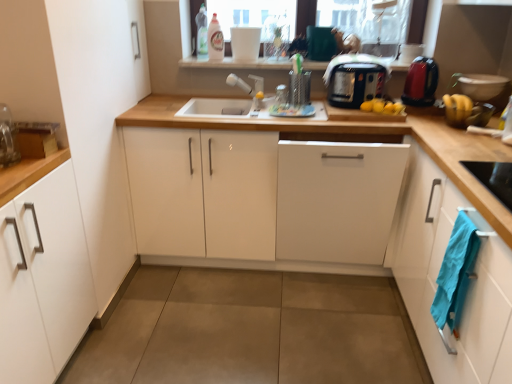
Image resolution: width=512 pixels, height=384 pixels. What do you see at coordinates (355, 84) in the screenshot?
I see `black plastic toaster at upper center, the first appliance in the left-to-right sequence` at bounding box center [355, 84].

This screenshot has width=512, height=384. I want to click on black plastic toaster at upper center, the first appliance in the left-to-right sequence, so click(x=355, y=84).

In order to face white glossy cabinet at center, the third cabinetry when ordered from right to left, should I rotate leftwards or rightwards?

A 0.737 degree turn to the right will do.

Where is `white glossy cabinet at center, arranged as the second cabinetry when viewed from the left`? The height and width of the screenshot is (384, 512). white glossy cabinet at center, arranged as the second cabinetry when viewed from the left is located at coordinates (262, 200).

What do you see at coordinates (337, 200) in the screenshot?
I see `white matte cabinet at center, the 3th cabinetry positioned from the left` at bounding box center [337, 200].

The image size is (512, 384). I want to click on white matte cabinet at right, acting as the 1th cabinetry starting from the right, so click(x=438, y=273).

Measure the distance between point (x=223, y=50) and camera.

They are 2.54 meters apart.

Locate an element on the screen. Image resolution: width=512 pixels, height=384 pixels. black plastic toaster at upper center, the first appliance in the left-to-right sequence is located at coordinates (355, 84).

In the scene shown: Does transparent plastic bottle at upper center, which is the first bottle in left-to-right order, have a greater width compared to white matte cabinet at center, the 3th cabinetry positioned from the left?

No, transparent plastic bottle at upper center, which is the first bottle in left-to-right order, is not wider than white matte cabinet at center, the 3th cabinetry positioned from the left.

From the image's perspective, which cabinetry is the 2nd one below the transparent plastic bottle at upper center, placed as the second bottle when sorted from right to left? Please provide its 2D coordinates.

[(337, 200)]

From a real-world perspective, is transparent plastic bottle at upper center, placed as the second bottle when sorted from right to left, located higher than white matte cabinet at center, the 3th cabinetry positioned from the left?

Yes.

Is point (23, 204) closer or farther from the camera than point (223, 52)?

Point (23, 204) is closer to the camera than point (223, 52).

Which object is positioned more to the left, white matte cabinet at left, marked as the 1th cabinetry in a left-to-right arrangement, or translucent plastic bottle at upper center, placed as the first bottle when sorted from right to left?

Positioned to the left is white matte cabinet at left, marked as the 1th cabinetry in a left-to-right arrangement.

Based on their sizes in the image, would you say white matte cabinet at left, the fourth cabinetry in the right-to-left sequence, is bigger or smaller than translucent plastic bottle at upper center, the 2th bottle from the left?

white matte cabinet at left, the fourth cabinetry in the right-to-left sequence, is bigger than translucent plastic bottle at upper center, the 2th bottle from the left.

Is white matte cabinet at left, the fourth cabinetry in the right-to-left sequence, further to camera compared to translucent plastic bottle at upper center, placed as the first bottle when sorted from right to left?

That is False.

From a real-world perspective, is blue cotton towel at lower right positioned under transparent plastic bottle at upper center, which is the first bottle in left-to-right order, based on gravity?

Yes, from a real-world perspective, blue cotton towel at lower right is beneath transparent plastic bottle at upper center, which is the first bottle in left-to-right order.

Considering the positions of points (435, 316) and (204, 55), is point (435, 316) farther from camera compared to point (204, 55)?

No, it is not.

Looking at this image, which of these two, blue cotton towel at lower right or transparent plastic bottle at upper center, placed as the second bottle when sorted from right to left, is bigger?

With larger size is blue cotton towel at lower right.

What's the angular difference between blue cotton towel at lower right and transparent plastic bottle at upper center, placed as the second bottle when sorted from right to left,'s facing directions?

They differ by 93.2 degrees in their facing directions.

Considering the positions of objects blue cotton towel at lower right and white matte faucet at center in the image provided, who is more to the left, blue cotton towel at lower right or white matte faucet at center?

Positioned to the left is white matte faucet at center.

Does blue cotton towel at lower right have a greater width compared to white matte faucet at center?

Incorrect, the width of blue cotton towel at lower right does not surpass that of white matte faucet at center.

Does blue cotton towel at lower right have a greater height compared to white matte faucet at center?

Yes.

Is blue cotton towel at lower right facing away from white matte faucet at center?

blue cotton towel at lower right does not have its back to white matte faucet at center.

Based on the photo, looking at the image, does blue cotton towel at lower right seem bigger or smaller compared to wooden at center?

In the image, blue cotton towel at lower right appears to be smaller than wooden at center.

Does point (444, 265) come in front of point (425, 116)?

Yes, it is in front of point (425, 116).

Is blue cotton towel at lower right not within wooden at center?

No.

This screenshot has height=384, width=512. Find the location of `laundry behind the wooden at center`. laundry behind the wooden at center is located at coordinates (455, 272).

From the picture: What's the angular difference between white matte cabinet at center, placed as the second cabinetry when sorted from right to left, and translucent plastic bottle at upper center, placed as the first bottle when sorted from right to left,'s facing directions?

The angular difference between white matte cabinet at center, placed as the second cabinetry when sorted from right to left, and translucent plastic bottle at upper center, placed as the first bottle when sorted from right to left, is 0.214 degrees.

How much distance is there between white matte cabinet at center, placed as the second cabinetry when sorted from right to left, and translucent plastic bottle at upper center, the 2th bottle from the left?

3.67 feet.

Does point (381, 176) come farther from viewer compared to point (215, 13)?

No, it is in front of (215, 13).

Which of these two, white matte cabinet at center, the 3th cabinetry positioned from the left, or translucent plastic bottle at upper center, placed as the first bottle when sorted from right to left, is wider?

With larger width is white matte cabinet at center, the 3th cabinetry positioned from the left.

Considering the positions of objects wooden at center and white matte cabinet at center, placed as the second cabinetry when sorted from right to left, in the image provided, who is in front, wooden at center or white matte cabinet at center, placed as the second cabinetry when sorted from right to left,?

Positioned in front is wooden at center.

From the image's perspective, who appears lower, wooden at center or white matte cabinet at center, the 3th cabinetry positioned from the left?

wooden at center is shown below in the image.

From a real-world perspective, is wooden at center on top of white matte cabinet at center, the 3th cabinetry positioned from the left?

Yes, from a real-world perspective, wooden at center is on top of white matte cabinet at center, the 3th cabinetry positioned from the left.

Does wooden at center have a greater height compared to white matte cabinet at center, placed as the second cabinetry when sorted from right to left?

Yes.

Where is `the 2nd bottle above when counting from the white matte cabinet at center, the 3th cabinetry positioned from the left (from the image's perspective)`? the 2nd bottle above when counting from the white matte cabinet at center, the 3th cabinetry positioned from the left (from the image's perspective) is located at coordinates (201, 32).

Locate an element on the screen. Image resolution: width=512 pixels, height=384 pixels. bottle that is the 1st one when counting backward from the white matte cabinet at left, the fourth cabinetry in the right-to-left sequence is located at coordinates (215, 40).

When comparing their distances from black plastic toaster at upper center, the first appliance in the left-to-right sequence, does white matte cabinet at right, acting as the 1th cabinetry starting from the right, or white matte faucet at center seem closer?

white matte faucet at center is closer to black plastic toaster at upper center, the first appliance in the left-to-right sequence.

Considering their positions, is white matte cabinet at right, marked as the 4th cabinetry in a left-to-right arrangement, positioned closer to black plastic toaster at upper center, the first appliance in the left-to-right sequence, than white matte cabinet at center, placed as the second cabinetry when sorted from right to left?

The object closer to black plastic toaster at upper center, the first appliance in the left-to-right sequence, is white matte cabinet at center, placed as the second cabinetry when sorted from right to left.

Based on their spatial positions, is white glossy cabinet at center, arranged as the second cabinetry when viewed from the left, or white matte cabinet at right, marked as the 4th cabinetry in a left-to-right arrangement, closer to white matte faucet at center?

Among the two, white glossy cabinet at center, arranged as the second cabinetry when viewed from the left, is located nearer to white matte faucet at center.

Estimate the real-world distances between objects in this image. Which object is closer to blue cotton towel at lower right, shiny red kettle at right, arranged as the second appliance when viewed from the left, or translucent plastic bottle at upper center, placed as the first bottle when sorted from right to left?

shiny red kettle at right, arranged as the second appliance when viewed from the left, is positioned closer to the anchor blue cotton towel at lower right.

When comparing their distances from white matte cabinet at right, acting as the 1th cabinetry starting from the right, does black plastic toaster at upper center, which is the second appliance from right to left, or white matte faucet at center seem further?

white matte faucet at center is further to white matte cabinet at right, acting as the 1th cabinetry starting from the right.

Based on their spatial positions, is translucent plastic bottle at upper center, the 2th bottle from the left, or black plastic toaster at upper center, which is the second appliance from right to left, further from white matte cabinet at right, marked as the 4th cabinetry in a left-to-right arrangement?

translucent plastic bottle at upper center, the 2th bottle from the left.

Estimate the real-world distances between objects in this image. Which object is closer to white matte cabinet at left, marked as the 1th cabinetry in a left-to-right arrangement, shiny red kettle at right, the 1th appliance when ordered from right to left, or black plastic toaster at upper center, which is the second appliance from right to left?

Among the two, black plastic toaster at upper center, which is the second appliance from right to left, is located nearer to white matte cabinet at left, marked as the 1th cabinetry in a left-to-right arrangement.

Considering their positions, is white matte cabinet at left, marked as the 1th cabinetry in a left-to-right arrangement, positioned further to transparent plastic bottle at upper center, which is the first bottle in left-to-right order, than white matte cabinet at center, the 3th cabinetry positioned from the left?

Based on the image, white matte cabinet at left, marked as the 1th cabinetry in a left-to-right arrangement, appears to be further to transparent plastic bottle at upper center, which is the first bottle in left-to-right order.

I want to click on laundry positioned between white matte cabinet at right, acting as the 1th cabinetry starting from the right, and white matte faucet at center from near to far, so click(455, 272).

Image resolution: width=512 pixels, height=384 pixels. I want to click on cabinetry between transparent plastic bottle at upper center, which is the first bottle in left-to-right order, and white matte cabinet at center, the 3th cabinetry positioned from the left, in the up-down direction, so click(x=262, y=200).

What are the coordinates of `laundry positioned between wooden at center and black plastic toaster at upper center, the first appliance in the left-to-right sequence, from near to far` in the screenshot? It's located at (455, 272).

The width and height of the screenshot is (512, 384). Find the location of `appliance between black plastic toaster at upper center, the first appliance in the left-to-right sequence, and white matte cabinet at center, the 3th cabinetry positioned from the left, from top to bottom`. appliance between black plastic toaster at upper center, the first appliance in the left-to-right sequence, and white matte cabinet at center, the 3th cabinetry positioned from the left, from top to bottom is located at coordinates (421, 82).